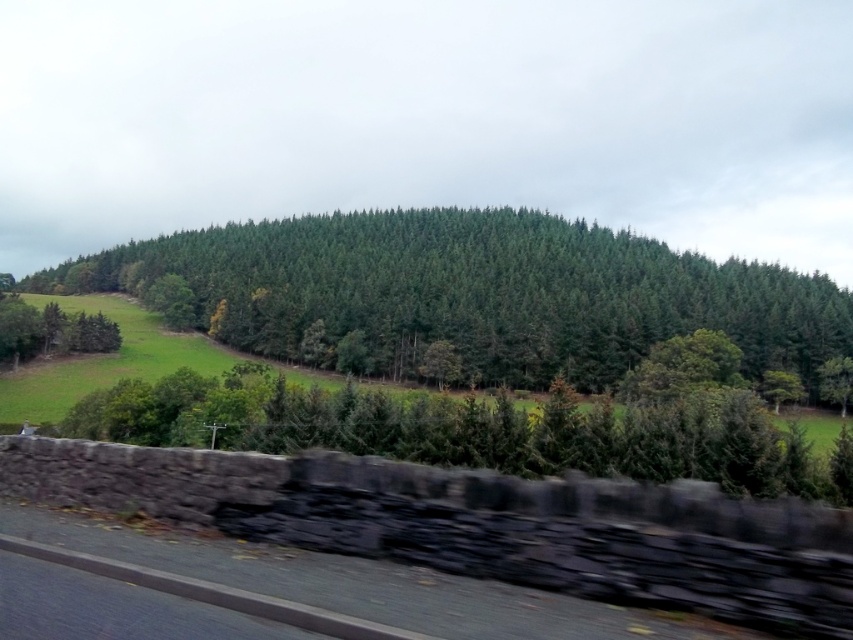
Can you confirm if green matte forest at center is thinner than black asphalt highway at lower left?

No.

Is green matte forest at center wider than black asphalt highway at lower left?

Correct, the width of green matte forest at center exceeds that of black asphalt highway at lower left.

The image size is (853, 640). Identify the location of green matte forest at center. (474, 292).

Locate an element on the screen. green matte forest at center is located at coordinates (474, 292).